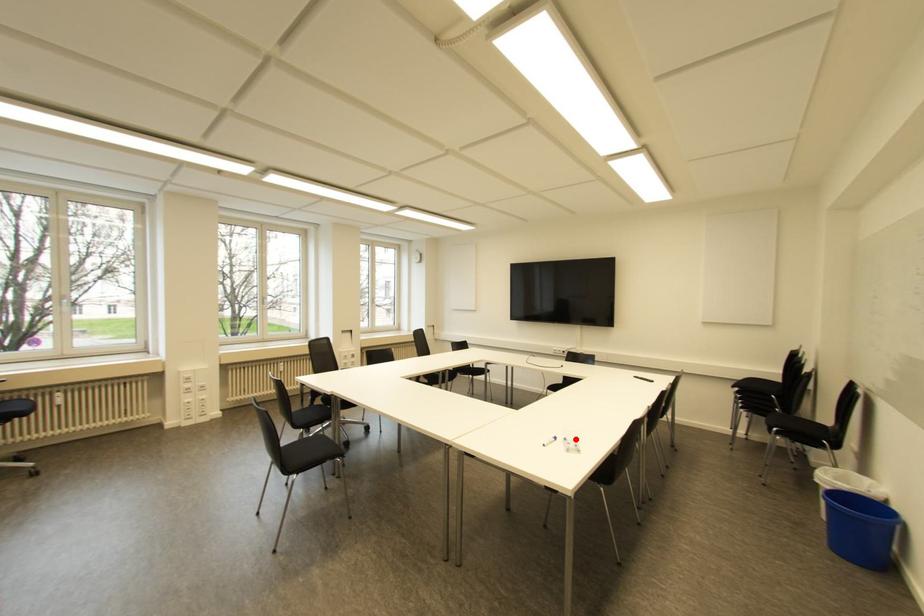
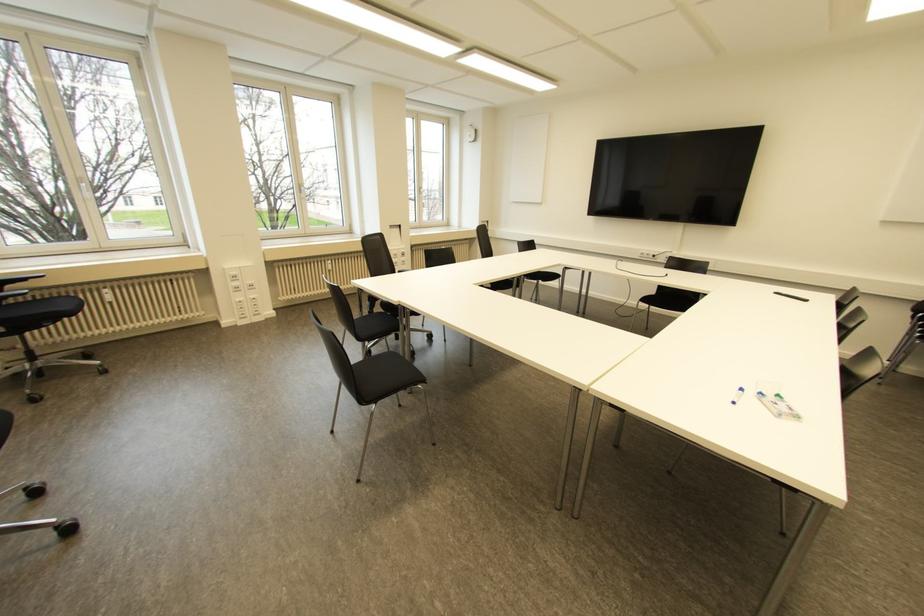
Where in the second image is the point corresponding to the highlighted location from the first image?

(777, 395)